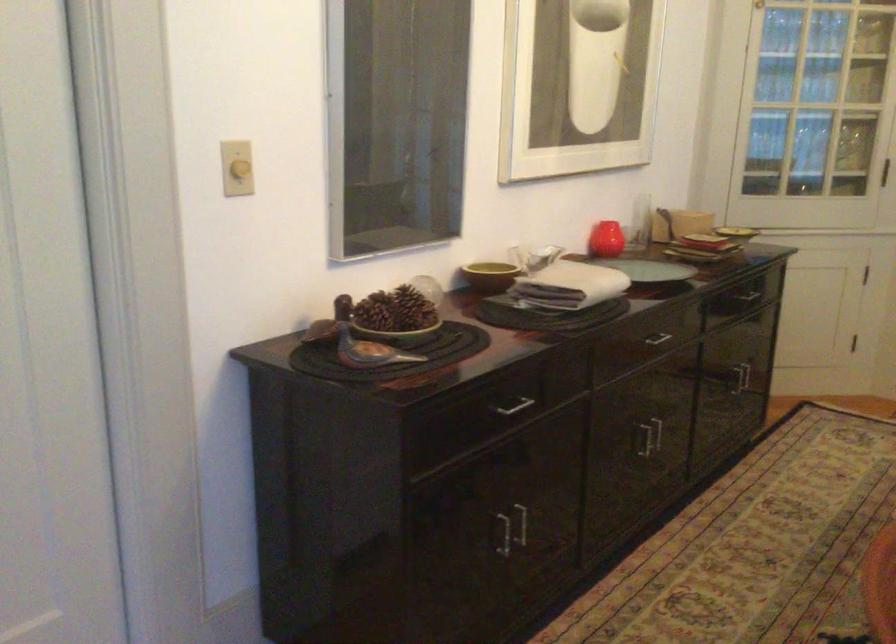
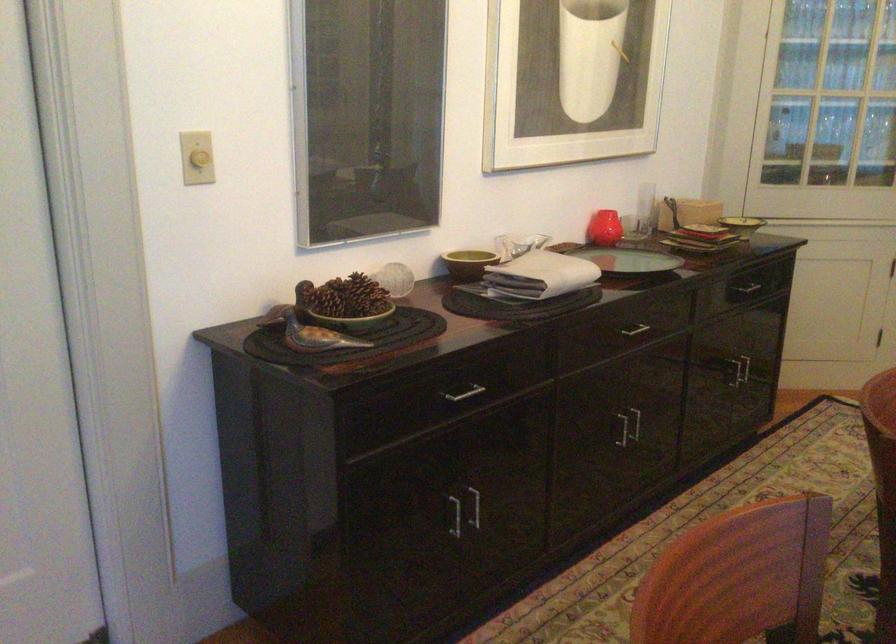
In the second image, find the point that corresponds to (736,236) in the first image.

(742, 225)